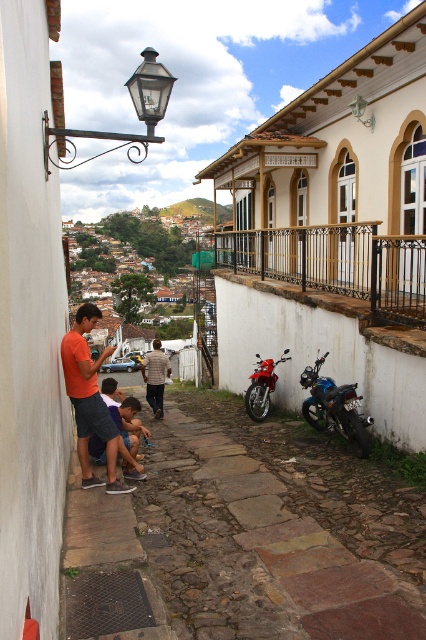
Can you confirm if orange matte shirt at lower left is wider than blue metallic motorbike at lower center?

Yes, orange matte shirt at lower left is wider than blue metallic motorbike at lower center.

Is orange matte shirt at lower left shorter than blue metallic motorbike at lower center?

Incorrect, orange matte shirt at lower left's height does not fall short of blue metallic motorbike at lower center's.

Who is more forward, (112, 429) or (345, 426)?

Point (112, 429) is more forward.

Locate an element on the screen. The height and width of the screenshot is (640, 426). orange matte shirt at lower left is located at coordinates (89, 397).

Based on the photo, who is positioned more to the left, blue metallic motorbike at lower center or light brown shirt at center?

From the viewer's perspective, light brown shirt at center appears more on the left side.

Between blue metallic motorbike at lower center and light brown shirt at center, which one is positioned higher?

blue metallic motorbike at lower center

Does point (321, 420) come closer to viewer compared to point (155, 368)?

Yes, it is.

The width and height of the screenshot is (426, 640). I want to click on blue metallic motorbike at lower center, so click(334, 406).

You are a GUI agent. You are given a task and a screenshot of the screen. Output one action in this format:
    pyautogui.click(x=<x>, y=<y>)
    Task: Click on the orange matte shirt at lower left
    This screenshot has width=426, height=640.
    Given the screenshot: What is the action you would take?
    pyautogui.click(x=89, y=397)

Which is in front, point (104, 412) or point (149, 396)?

Point (104, 412) is more forward.

The image size is (426, 640). I want to click on orange matte shirt at lower left, so click(89, 397).